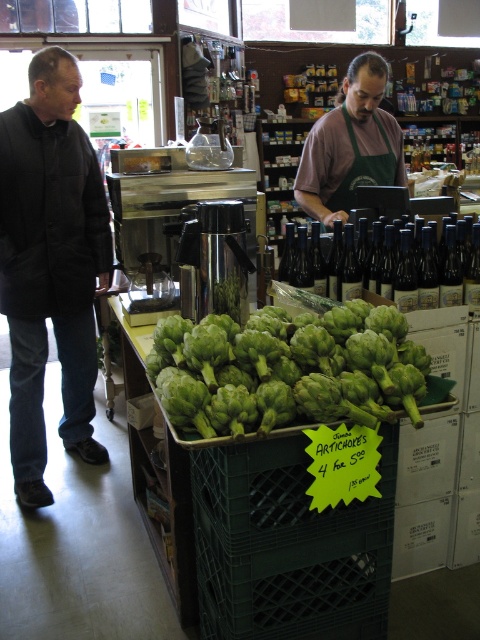
Question: Is green matte artichoke at center in front of green apron at center?

Choices:
 (A) no
 (B) yes

Answer: (B)

Question: Which of the following is the closest to the observer?

Choices:
 (A) (408, 410)
 (B) (388, 134)

Answer: (A)

Question: Which object is closer to the camera taking this photo?

Choices:
 (A) dark glass bottles at center
 (B) green matte artichoke at center
 (C) black matte jacket at left
 (D) green apron at center

Answer: (B)

Question: Estimate the real-world distances between objects in this image. Which object is farther from the green apron at center?

Choices:
 (A) black matte jacket at left
 (B) green matte artichoke at center

Answer: (B)

Question: Is green matte artichoke at center positioned before green apron at center?

Choices:
 (A) yes
 (B) no

Answer: (A)

Question: Is black matte jacket at left to the left of green apron at center from the viewer's perspective?

Choices:
 (A) no
 (B) yes

Answer: (B)